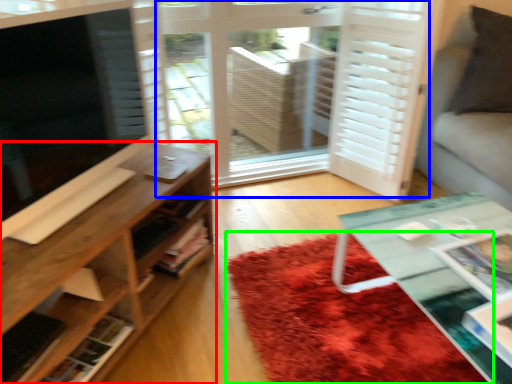
Question: Which is farther away from shelf (highlighted by a red box)? screen door (highlighted by a blue box) or mat (highlighted by a green box)?

Choices:
 (A) screen door
 (B) mat

Answer: (A)